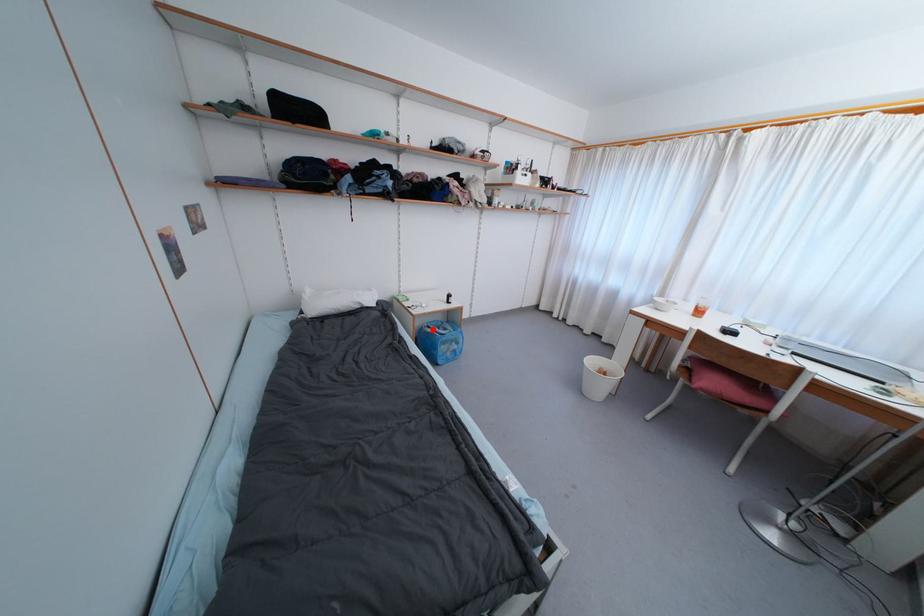
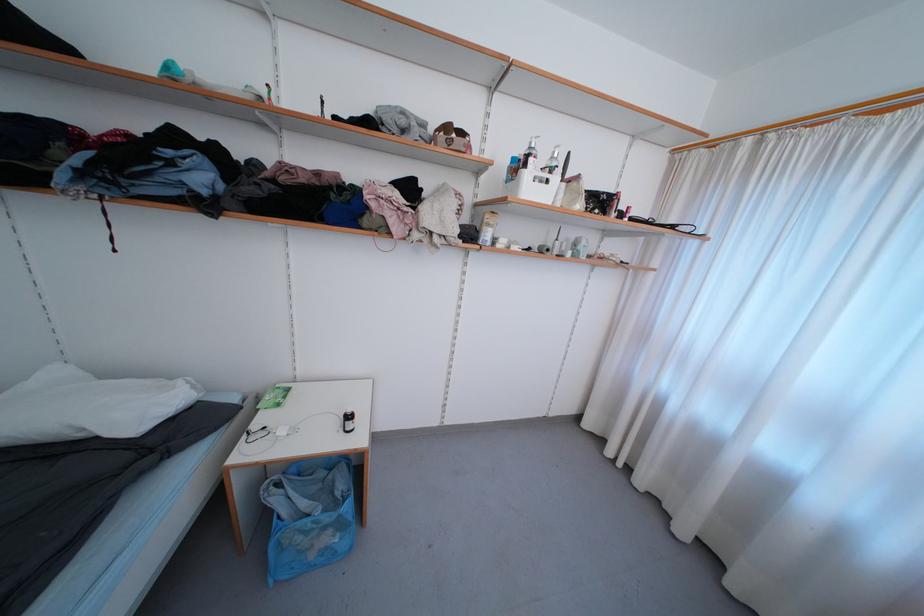
Find the pixel in the second image that matches the highlighted location in the first image.

(284, 488)